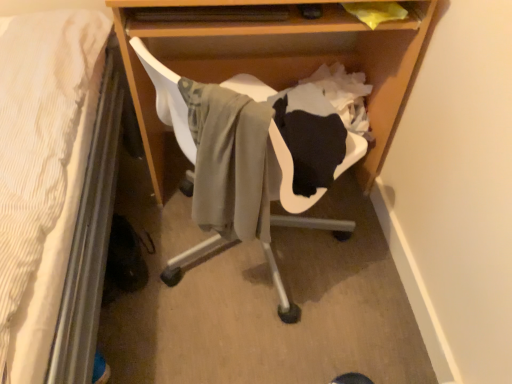
Question: Looking at their shapes, would you say wooden desk at center is wider or thinner than white plastic swivel chair at center?

Choices:
 (A) thin
 (B) wide

Answer: (B)

Question: Is wooden desk at center to the left or to the right of white plastic swivel chair at center in the image?

Choices:
 (A) left
 (B) right

Answer: (B)

Question: From the image's perspective, is wooden desk at center located above or below white plastic swivel chair at center?

Choices:
 (A) above
 (B) below

Answer: (A)

Question: Is white plastic swivel chair at center in front of or behind wooden desk at center in the image?

Choices:
 (A) behind
 (B) front

Answer: (B)

Question: Which is correct: white plastic swivel chair at center is inside wooden desk at center, or outside of it?

Choices:
 (A) inside
 (B) outside

Answer: (B)

Question: Looking at the image, does white plastic swivel chair at center seem bigger or smaller compared to wooden desk at center?

Choices:
 (A) small
 (B) big

Answer: (A)

Question: Considering the positions of point (336, 226) and point (369, 109), is point (336, 226) closer or farther from the camera than point (369, 109)?

Choices:
 (A) farther
 (B) closer

Answer: (B)